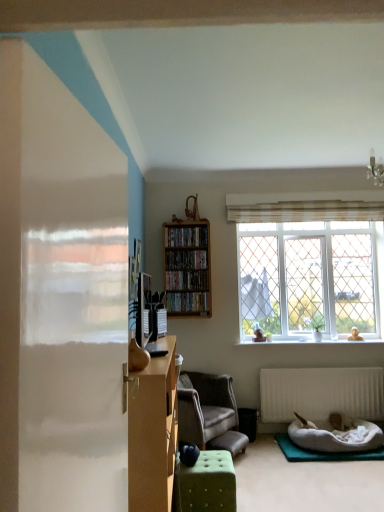
This screenshot has width=384, height=512. Find the location of `free spot above green fabric ottoman at lower center (from a real-world perspective)`. free spot above green fabric ottoman at lower center (from a real-world perspective) is located at coordinates (210, 459).